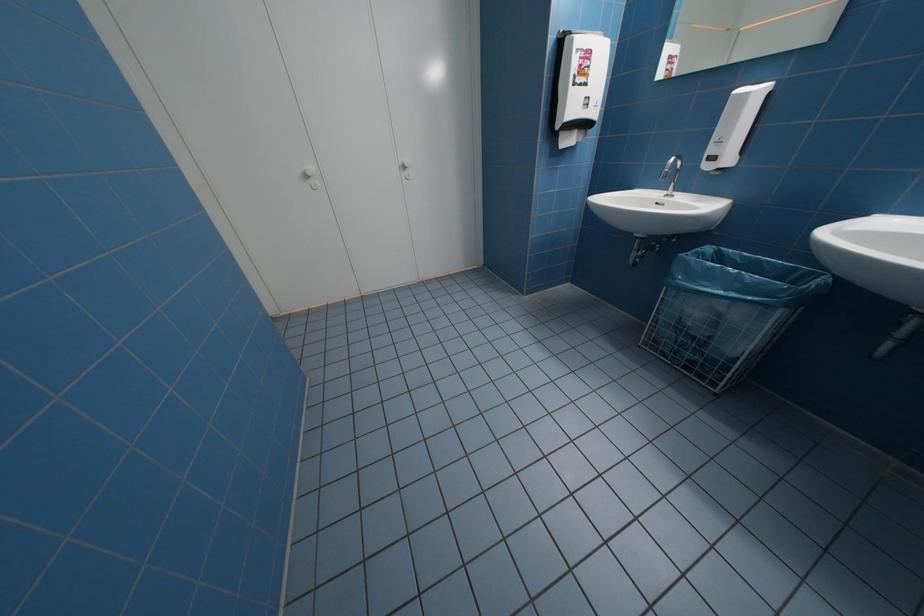
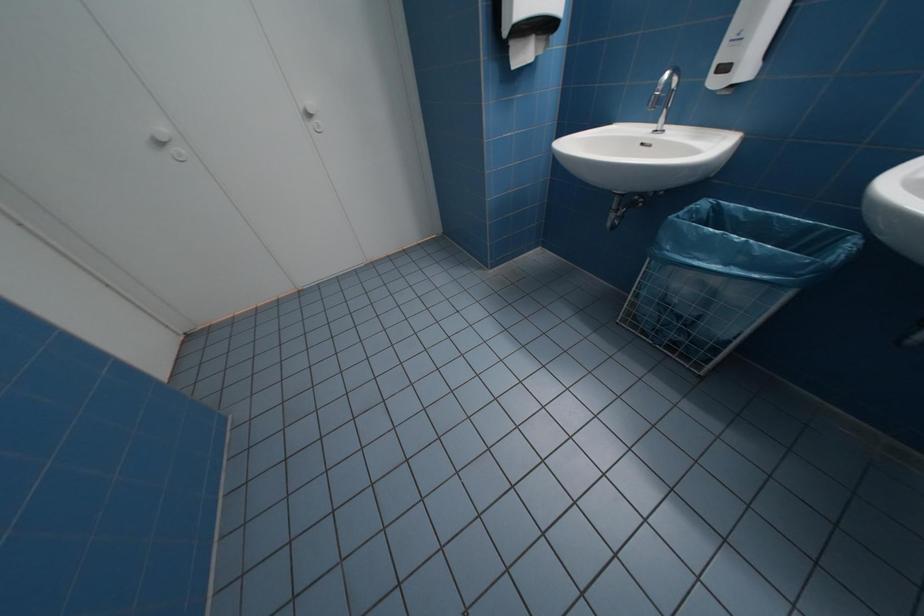
Question: The images are taken continuously from a first-person perspective. In which direction is your viewpoint rotating?

Choices:
 (A) Left
 (B) Right
 (C) Up
 (D) Down

Answer: (D)